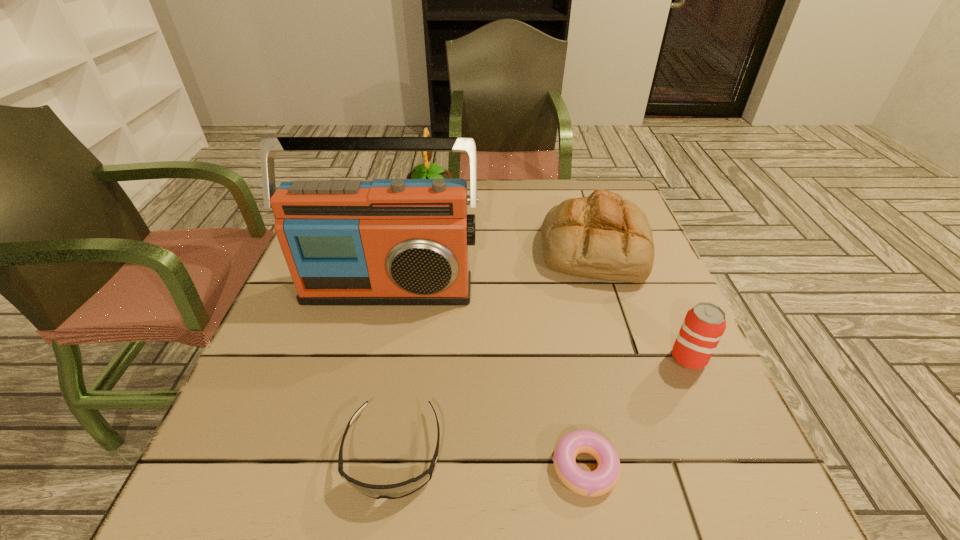
Locate an element on the screen. vacant space located on the front of the beer can is located at coordinates (745, 484).

This screenshot has height=540, width=960. I want to click on free space located 0.100m on the left of the doughnut, so click(488, 467).

This screenshot has height=540, width=960. In order to click on sunflower situated at the far edge in this screenshot , I will do coord(423,171).

Locate an element on the screen. The image size is (960, 540). bread located at the far edge is located at coordinates (602, 236).

At what (x,y) coordinates should I click in order to perform the action: click on goggles located in the near edge section of the desktop. Please return your answer as a coordinate pair (x, y). Image resolution: width=960 pixels, height=540 pixels. Looking at the image, I should click on (391, 491).

Find the location of a particular element. Image resolution: width=960 pixels, height=540 pixels. doughnut that is at the near edge is located at coordinates (600, 481).

The image size is (960, 540). What are the coordinates of `object that is at the left edge` in the screenshot? It's located at (388, 241).

Find the location of `bread that is at the right edge`. bread that is at the right edge is located at coordinates (602, 236).

Where is `beer can that is at the right edge`? beer can that is at the right edge is located at coordinates (704, 324).

You are a GUI agent. You are given a task and a screenshot of the screen. Output one action in this format:
    pyautogui.click(x=<x>, y=<y>)
    Task: Click on the object positioned at the far right corner
    The image size is (960, 540).
    Given the screenshot: What is the action you would take?
    pyautogui.click(x=602, y=236)